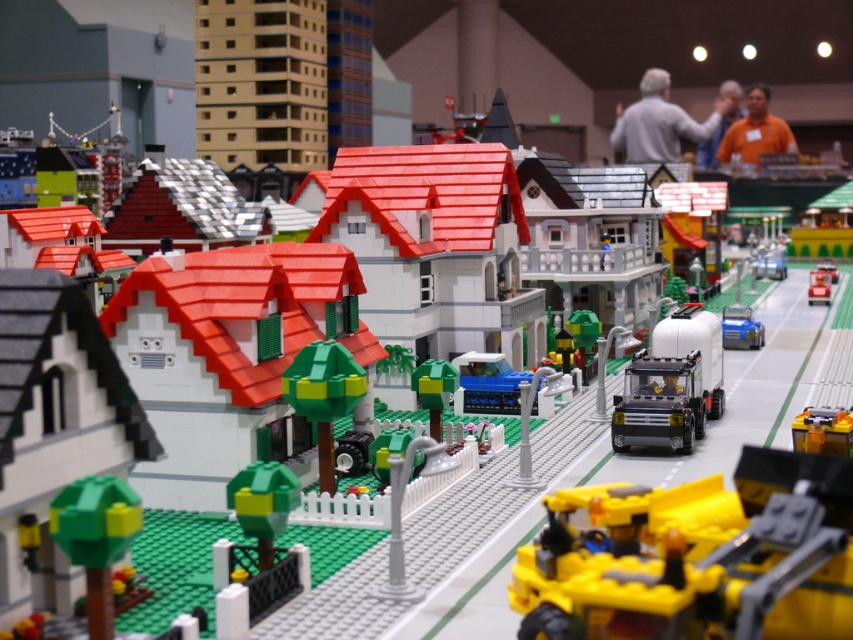
Does smooth white house at center lie in front of metallic silver car at center?

Yes, it is.

Who is more distant from viewer, [357,316] or [822,275]?

Point [822,275]

What are the coordinates of `smooth white house at center` in the screenshot? It's located at (229, 356).

Is metallic silver tanker truck at center-right closer to the viewer compared to yellow plastic truck at center?

No, it is behind yellow plastic truck at center.

Between point (712, 349) and point (827, 422), which one is positioned in front?

Point (827, 422)

The width and height of the screenshot is (853, 640). I want to click on metallic silver tanker truck at center-right, so click(x=671, y=384).

Does point (488, 369) come closer to viewer compared to point (827, 275)?

Yes, it is.

Can you confirm if blue plastic truck at center is positioned above metallic silver car at center?

No.

Does point (486, 356) come farther from viewer compared to point (815, 289)?

No, (486, 356) is in front of (815, 289).

Find the location of a particular element. blue plastic truck at center is located at coordinates (486, 385).